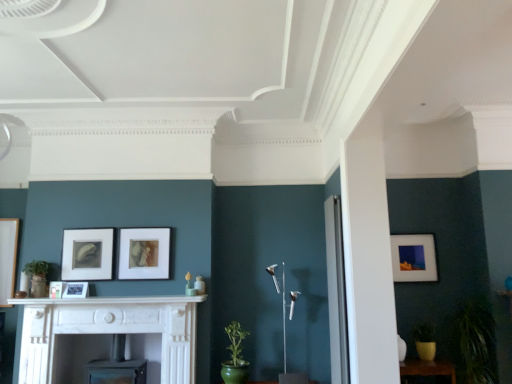
Question: From a real-world perspective, relative to matte black picture frame at center left, the third picture frame viewed from the left, is white marble fireplace at lower left vertically above or below?

Choices:
 (A) above
 (B) below

Answer: (B)

Question: Does point (109, 301) appear closer or farther from the camera than point (108, 264)?

Choices:
 (A) farther
 (B) closer

Answer: (B)

Question: Which object is the closest to the white marble fireplace at lower left?

Choices:
 (A) matte black picture frame at center left, arranged as the 2th picture frame when viewed from the back
 (B) wooden table at lower right
 (C) matte brown picture frame at center, which is the third picture frame in back-to-front order
 (D) white marble mantle at center
 (E) matte white picture frame at right, the fifth picture frame viewed from the left

Answer: (D)

Question: Based on their relative distances, which object is farther from the matte black picture frame at center, positioned as the second picture frame in left-to-right order?

Choices:
 (A) wooden table at lower right
 (B) green glazed pot at lower center, placed as the 1th plant when sorted from left to right
 (C) white marble mantle at center
 (D) matte black picture frame at center left, the third picture frame positioned from the right
 (E) white marble fireplace at lower left

Answer: (A)